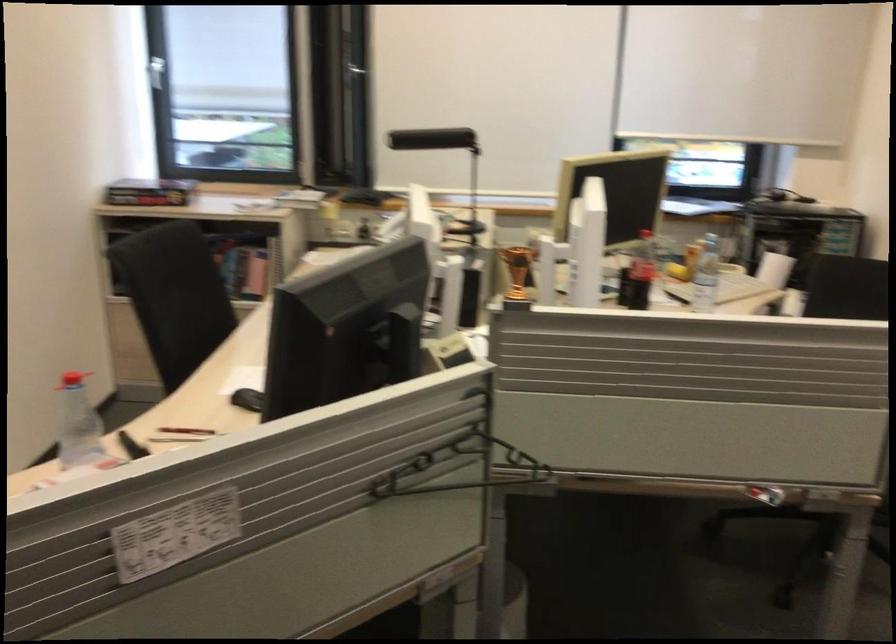
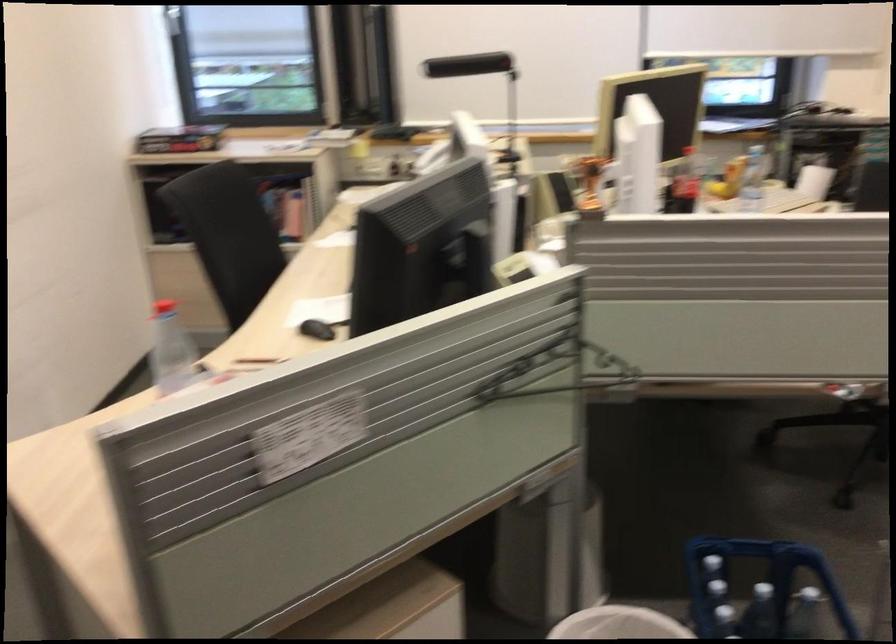
Question: How did the camera likely rotate?

Choices:
 (A) Left
 (B) Right
 (C) Up
 (D) Down

Answer: (D)